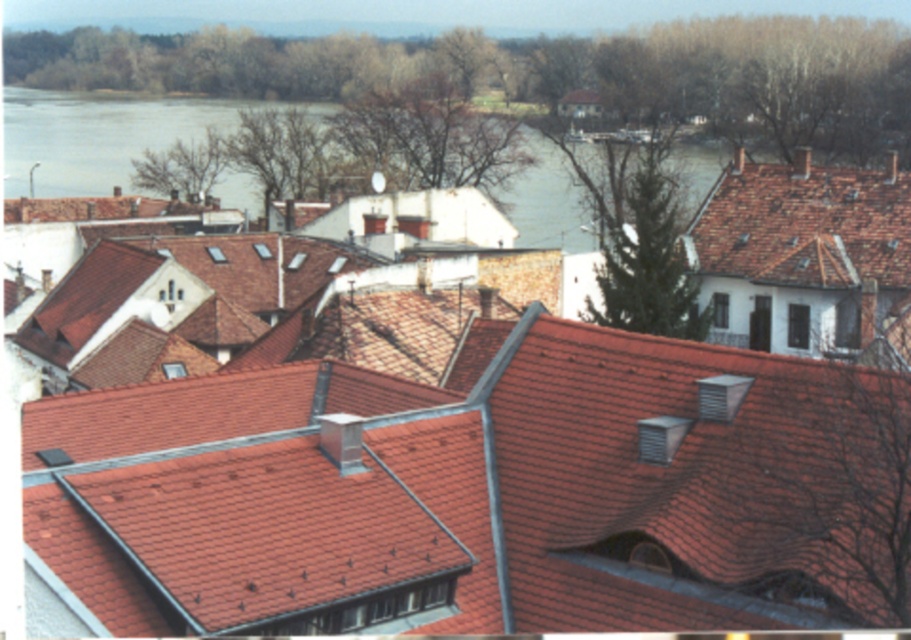
Question: Can you confirm if red clay tiles at center is positioned below blue water at upper center?

Choices:
 (A) yes
 (B) no

Answer: (A)

Question: Estimate the real-world distances between objects in this image. Which object is farther from the blue water at upper center?

Choices:
 (A) red clay tiles at center
 (B) red tile roof at upper right

Answer: (A)

Question: Can you confirm if blue water at upper center is smaller than red tile roof at upper right?

Choices:
 (A) yes
 (B) no

Answer: (B)

Question: Which of the following is the farthest from the observer?

Choices:
 (A) red tile roof at upper right
 (B) red clay tiles at center

Answer: (A)

Question: Observing the image, what is the correct spatial positioning of blue water at upper center in reference to red tile roof at upper right?

Choices:
 (A) left
 (B) right

Answer: (A)

Question: Which point is closer to the camera?

Choices:
 (A) blue water at upper center
 (B) red clay tiles at center

Answer: (B)